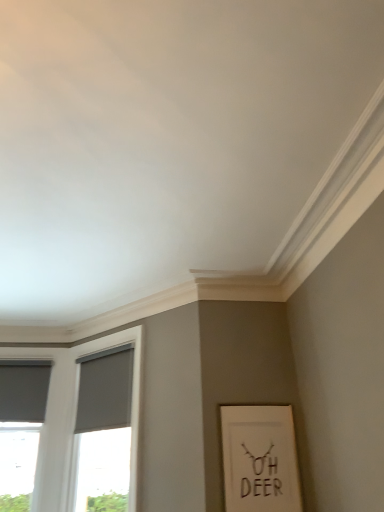
Image resolution: width=384 pixels, height=512 pixels. What do you see at coordinates (105, 390) in the screenshot? I see `matte gray curtain at lower left, which is the 1th curtain in right-to-left order` at bounding box center [105, 390].

At what (x,y) coordinates should I click in order to perform the action: click on matte gray window at left. Please return your answer as a coordinate pair (x, y). Looking at the image, I should click on (75, 414).

Find the location of a particular element. white matte picture frame at lower right is located at coordinates (260, 459).

This screenshot has width=384, height=512. Find the location of `matte gray curtain at lower left, which is the 1th curtain in right-to-left order`. matte gray curtain at lower left, which is the 1th curtain in right-to-left order is located at coordinates (105, 390).

Considering the sizes of matte gray curtain at left, the second curtain in the right-to-left sequence, and matte gray window at left in the image, is matte gray curtain at left, the second curtain in the right-to-left sequence, wider or thinner than matte gray window at left?

Clearly, matte gray curtain at left, the second curtain in the right-to-left sequence, has less width compared to matte gray window at left.

Is matte gray curtain at left, marked as the 1th curtain in a left-to-right arrangement, oriented away from matte gray window at left?

That's not correct — matte gray curtain at left, marked as the 1th curtain in a left-to-right arrangement, is not looking away from matte gray window at left.

In the scene shown: Are matte gray curtain at left, the second curtain in the right-to-left sequence, and matte gray window at left far apart?

No, there isn't a large distance between matte gray curtain at left, the second curtain in the right-to-left sequence, and matte gray window at left.

Is matte gray curtain at left, the second curtain in the right-to-left sequence, inside or outside of matte gray window at left?

matte gray curtain at left, the second curtain in the right-to-left sequence, is located beyond the bounds of matte gray window at left.

Considering the sizes of matte gray curtain at lower left, which is the 1th curtain in right-to-left order, and matte gray window at left in the image, is matte gray curtain at lower left, which is the 1th curtain in right-to-left order, wider or thinner than matte gray window at left?

In the image, matte gray curtain at lower left, which is the 1th curtain in right-to-left order, appears to be more narrow than matte gray window at left.

How distant is matte gray curtain at lower left, acting as the second curtain starting from the left, from matte gray window at left?

The distance of matte gray curtain at lower left, acting as the second curtain starting from the left, from matte gray window at left is 9.11 inches.

How different are the orientations of matte gray curtain at lower left, which is the 1th curtain in right-to-left order, and matte gray window at left in degrees?

They differ by 1.77 degrees in their facing directions.

Is matte gray curtain at lower left, which is the 1th curtain in right-to-left order, to the left of matte gray window at left from the viewer's perspective?

Correct, you'll find matte gray curtain at lower left, which is the 1th curtain in right-to-left order, to the left of matte gray window at left.

Is matte gray window at left further to camera compared to white matte picture frame at lower right?

Yes, it is behind white matte picture frame at lower right.

Who is shorter, matte gray window at left or white matte picture frame at lower right?

white matte picture frame at lower right.

Are matte gray window at left and white matte picture frame at lower right located far from each other?

Yes.

How much distance is there between matte gray window at left and white matte picture frame at lower right?

3.65 feet.

Considering the relative positions of white matte picture frame at lower right and matte gray curtain at lower left, acting as the second curtain starting from the left, in the image provided, is white matte picture frame at lower right behind matte gray curtain at lower left, acting as the second curtain starting from the left,?

No.

Does white matte picture frame at lower right have a greater width compared to matte gray curtain at lower left, which is the 1th curtain in right-to-left order?

Incorrect, the width of white matte picture frame at lower right does not surpass that of matte gray curtain at lower left, which is the 1th curtain in right-to-left order.

Can you confirm if white matte picture frame at lower right is taller than matte gray curtain at lower left, which is the 1th curtain in right-to-left order?

Yes, white matte picture frame at lower right is taller than matte gray curtain at lower left, which is the 1th curtain in right-to-left order.

Is white matte picture frame at lower right smaller than matte gray curtain at lower left, acting as the second curtain starting from the left?

Yes.

Is matte gray window at left bigger than matte gray curtain at left, marked as the 1th curtain in a left-to-right arrangement?

Yes, matte gray window at left is bigger than matte gray curtain at left, marked as the 1th curtain in a left-to-right arrangement.

Does point (134, 473) lie in front of point (36, 416)?

That is True.

Image resolution: width=384 pixels, height=512 pixels. In order to click on window on the right of matte gray curtain at left, the second curtain in the right-to-left sequence in this screenshot , I will do `click(75, 414)`.

Based on their sizes in the image, would you say white matte picture frame at lower right is bigger or smaller than matte gray curtain at left, the second curtain in the right-to-left sequence?

Considering their sizes, white matte picture frame at lower right takes up less space than matte gray curtain at left, the second curtain in the right-to-left sequence.

Can you confirm if white matte picture frame at lower right is taller than matte gray curtain at left, the second curtain in the right-to-left sequence?

Indeed, white matte picture frame at lower right has a greater height compared to matte gray curtain at left, the second curtain in the right-to-left sequence.

Are white matte picture frame at lower right and matte gray curtain at left, the second curtain in the right-to-left sequence, beside each other?

There is a gap between white matte picture frame at lower right and matte gray curtain at left, the second curtain in the right-to-left sequence.

From the image's perspective, who appears lower, white matte picture frame at lower right or matte gray curtain at left, the second curtain in the right-to-left sequence?

white matte picture frame at lower right, from the image's perspective.

Considering the sizes of matte gray curtain at left, marked as the 1th curtain in a left-to-right arrangement, and matte gray curtain at lower left, acting as the second curtain starting from the left, in the image, is matte gray curtain at left, marked as the 1th curtain in a left-to-right arrangement, bigger or smaller than matte gray curtain at lower left, acting as the second curtain starting from the left,?

Clearly, matte gray curtain at left, marked as the 1th curtain in a left-to-right arrangement, is smaller in size than matte gray curtain at lower left, acting as the second curtain starting from the left.

Is matte gray curtain at left, the second curtain in the right-to-left sequence, not near matte gray curtain at lower left, which is the 1th curtain in right-to-left order?

matte gray curtain at left, the second curtain in the right-to-left sequence, is actually quite close to matte gray curtain at lower left, which is the 1th curtain in right-to-left order.

Is matte gray curtain at left, the second curtain in the right-to-left sequence, located outside matte gray curtain at lower left, acting as the second curtain starting from the left?

Yes, matte gray curtain at left, the second curtain in the right-to-left sequence, is located beyond the bounds of matte gray curtain at lower left, acting as the second curtain starting from the left.

Does matte gray curtain at left, marked as the 1th curtain in a left-to-right arrangement, have a greater width compared to matte gray curtain at lower left, which is the 1th curtain in right-to-left order?

No.

Locate an element on the screen. window in front of the matte gray curtain at left, marked as the 1th curtain in a left-to-right arrangement is located at coordinates (75, 414).

Where is `window lying below the matte gray curtain at lower left, acting as the second curtain starting from the left (from the image's perspective)`? window lying below the matte gray curtain at lower left, acting as the second curtain starting from the left (from the image's perspective) is located at coordinates pyautogui.click(x=75, y=414).

Looking at this image, considering their positions, is matte gray window at left positioned further to matte gray curtain at left, the second curtain in the right-to-left sequence, than matte gray curtain at lower left, which is the 1th curtain in right-to-left order?

matte gray curtain at lower left, which is the 1th curtain in right-to-left order, is further to matte gray curtain at left, the second curtain in the right-to-left sequence.

In the scene shown: Estimate the real-world distances between objects in this image. Which object is further from matte gray curtain at lower left, acting as the second curtain starting from the left, matte gray curtain at left, the second curtain in the right-to-left sequence, or white matte picture frame at lower right?

white matte picture frame at lower right lies further to matte gray curtain at lower left, acting as the second curtain starting from the left, than the other object.

Based on their spatial positions, is matte gray window at left or white matte picture frame at lower right closer to matte gray curtain at lower left, which is the 1th curtain in right-to-left order?

matte gray window at left is closer to matte gray curtain at lower left, which is the 1th curtain in right-to-left order.

When comparing their distances from matte gray curtain at left, marked as the 1th curtain in a left-to-right arrangement, does white matte picture frame at lower right or matte gray curtain at lower left, acting as the second curtain starting from the left, seem further?

The object further to matte gray curtain at left, marked as the 1th curtain in a left-to-right arrangement, is white matte picture frame at lower right.

Based on the photo, looking at the image, which one is located further to matte gray curtain at left, marked as the 1th curtain in a left-to-right arrangement, matte gray curtain at lower left, which is the 1th curtain in right-to-left order, or white matte picture frame at lower right?

Answer: white matte picture frame at lower right is further to matte gray curtain at left, marked as the 1th curtain in a left-to-right arrangement.

When comparing their distances from white matte picture frame at lower right, does matte gray window at left or matte gray curtain at left, the second curtain in the right-to-left sequence, seem further?

matte gray curtain at left, the second curtain in the right-to-left sequence.

Looking at the image, which one is located closer to matte gray window at left, matte gray curtain at left, the second curtain in the right-to-left sequence, or white matte picture frame at lower right?

matte gray curtain at left, the second curtain in the right-to-left sequence, lies closer to matte gray window at left than the other object.

From the image, which object appears to be farther from white matte picture frame at lower right, matte gray curtain at lower left, which is the 1th curtain in right-to-left order, or matte gray window at left?

Among the two, matte gray curtain at lower left, which is the 1th curtain in right-to-left order, is located further to white matte picture frame at lower right.

Where is `window between matte gray curtain at left, marked as the 1th curtain in a left-to-right arrangement, and white matte picture frame at lower right from left to right`? This screenshot has height=512, width=384. window between matte gray curtain at left, marked as the 1th curtain in a left-to-right arrangement, and white matte picture frame at lower right from left to right is located at coordinates (75, 414).

Locate an element on the screen. The height and width of the screenshot is (512, 384). window located between matte gray curtain at lower left, acting as the second curtain starting from the left, and white matte picture frame at lower right in the left-right direction is located at coordinates (75, 414).

The width and height of the screenshot is (384, 512). Find the location of `curtain situated between matte gray curtain at left, marked as the 1th curtain in a left-to-right arrangement, and white matte picture frame at lower right from left to right`. curtain situated between matte gray curtain at left, marked as the 1th curtain in a left-to-right arrangement, and white matte picture frame at lower right from left to right is located at coordinates (105, 390).

Locate an element on the screen. This screenshot has width=384, height=512. curtain between matte gray curtain at left, the second curtain in the right-to-left sequence, and matte gray window at left from left to right is located at coordinates (105, 390).